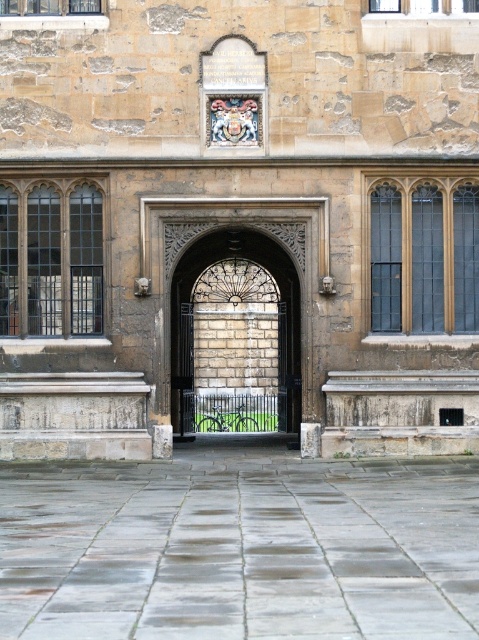
Where is `dark brown wooden window at left`? Image resolution: width=479 pixels, height=640 pixels. dark brown wooden window at left is located at coordinates (50, 260).

Does dark brown wooden window at left have a larger size compared to clear glass window at upper left?

Yes.

Measure the distance between point (77, 244) and camera.

Point (77, 244) and camera are 24.75 meters apart.

Find the location of a particular element. The height and width of the screenshot is (640, 479). dark brown wooden window at left is located at coordinates (50, 260).

The image size is (479, 640). What do you see at coordinates (236, 333) in the screenshot? I see `dark brown stone gate at center` at bounding box center [236, 333].

Can you confirm if dark brown stone gate at center is positioned below matte glass window at right?

Yes.

Identify the location of dark brown stone gate at center. This screenshot has height=640, width=479. (236, 333).

Image resolution: width=479 pixels, height=640 pixels. I want to click on dark brown stone gate at center, so click(x=236, y=333).

Looking at this image, does dark brown stone gate at center have a larger size compared to dark brown wooden window at left?

Actually, dark brown stone gate at center might be smaller than dark brown wooden window at left.

Does point (257, 362) lie in front of point (41, 221)?

No, (257, 362) is further to viewer.

At what (x,y) coordinates should I click in order to perform the action: click on dark brown stone gate at center. Please return your answer as a coordinate pair (x, y). Looking at the image, I should click on (236, 333).

What are the coordinates of `dark brown stone gate at center` in the screenshot? It's located at (236, 333).